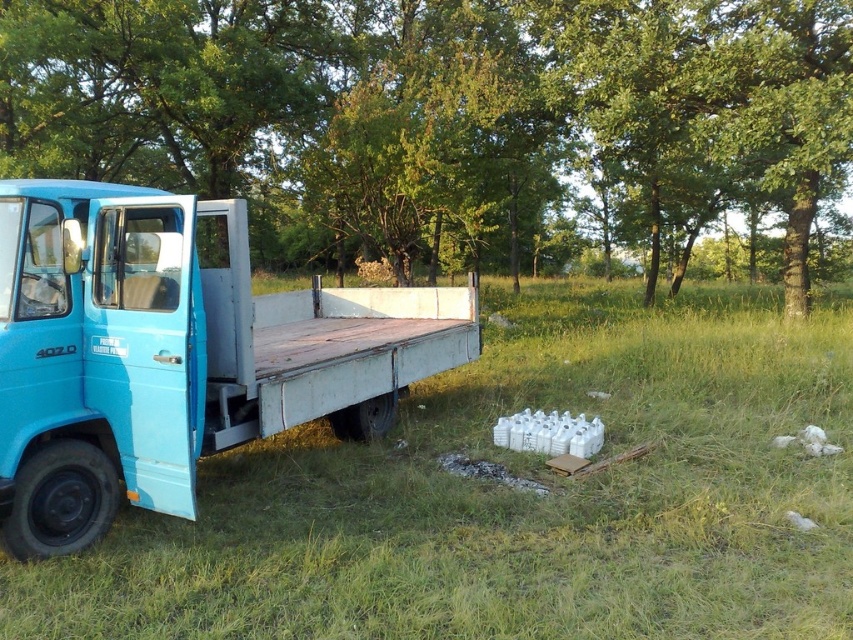
Between green leafy tree at upper center and blue matte truck at left, which one appears on the left side from the viewer's perspective?

blue matte truck at left is more to the left.

The width and height of the screenshot is (853, 640). In order to click on green leafy tree at upper center in this screenshot , I will do `click(450, 122)`.

At what (x,y) coordinates should I click in order to perform the action: click on green leafy tree at upper center. Please return your answer as a coordinate pair (x, y). Looking at the image, I should click on (450, 122).

Does point (318, 435) lie behind point (178, 326)?

Yes.

Does green grassy at lower left have a greater width compared to blue matte truck at left?

Indeed, green grassy at lower left has a greater width compared to blue matte truck at left.

Locate an element on the screen. The width and height of the screenshot is (853, 640). green grassy at lower left is located at coordinates (517, 496).

Does green leafy tree at upper center have a lesser height compared to green grassy at lower left?

No.

Is green leafy tree at upper center taller than green grassy at lower left?

Yes.

Is point (51, 54) positioned before point (740, 419)?

No, (51, 54) is behind (740, 419).

Identify the location of green leafy tree at upper center. The height and width of the screenshot is (640, 853). (450, 122).